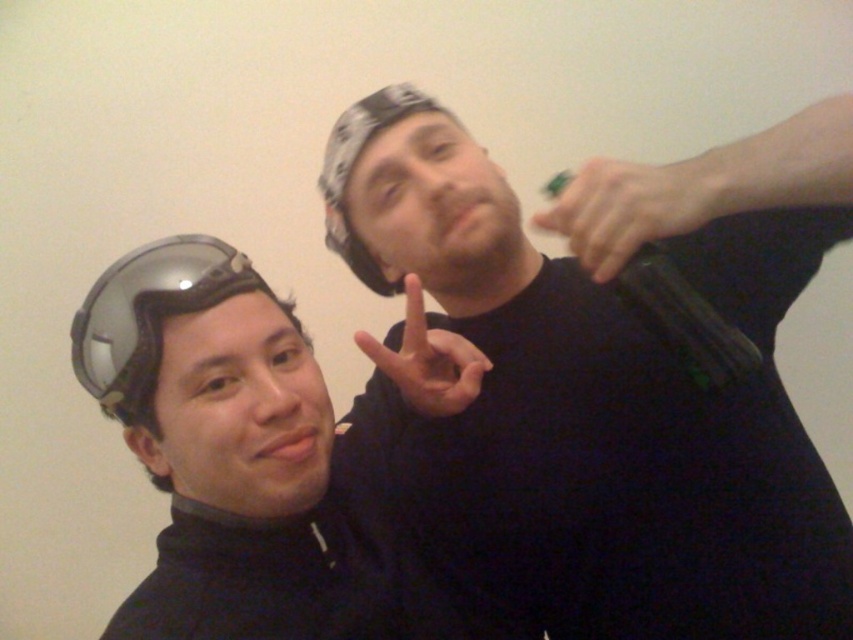
You are an AI analyzing the image. The black matte shirt at upper right is located at coordinates. What are its coordinates?

The black matte shirt at upper right is located at coordinates point (608, 380).

You are standing in front of the image and want to touch both points. Which point should you reach for first, point (303, 401) or point (125, 340)?

You should reach for point (303, 401) first because it is closer to you than point (125, 340).

You are a photographer setting up for a portrait. You need to ensure that the green matte hand at upper right and the transparent plastic goggles at left are both in focus. Which object should you adjust your camera focus to prioritize for a better chance of both being sharp?

The green matte hand at upper right is wider than the transparent plastic goggles at left, so prioritizing focus on the larger green matte hand at upper right would increase the likelihood of both objects being in focus.